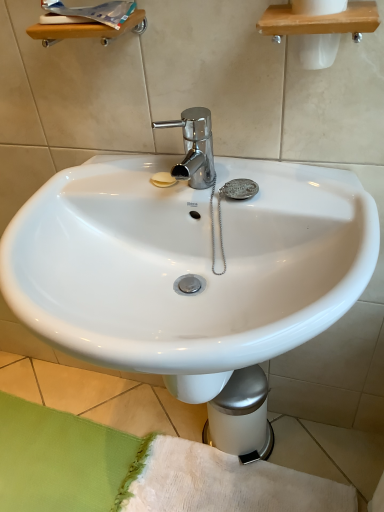
Question: Considering the relative sizes of green fabric bath mat at lower left and white glossy sink at center in the image provided, is green fabric bath mat at lower left shorter than white glossy sink at center?

Choices:
 (A) no
 (B) yes

Answer: (B)

Question: Is green fabric bath mat at lower left wider than white glossy sink at center?

Choices:
 (A) no
 (B) yes

Answer: (B)

Question: Is white glossy sink at center surrounded by green fabric bath mat at lower left?

Choices:
 (A) no
 (B) yes

Answer: (A)

Question: From a real-world perspective, is green fabric bath mat at lower left under white glossy sink at center?

Choices:
 (A) yes
 (B) no

Answer: (A)

Question: Considering the relative positions of green fabric bath mat at lower left and white glossy sink at center in the image provided, is green fabric bath mat at lower left to the right of white glossy sink at center from the viewer's perspective?

Choices:
 (A) yes
 (B) no

Answer: (B)

Question: Is green fabric bath mat at lower left smaller than white glossy sink at center?

Choices:
 (A) no
 (B) yes

Answer: (B)

Question: From a real-world perspective, is white glossy sink at center beneath green fabric bath mat at lower left?

Choices:
 (A) yes
 (B) no

Answer: (B)

Question: Is white glossy sink at center positioned with its back to green fabric bath mat at lower left?

Choices:
 (A) yes
 (B) no

Answer: (B)

Question: Is white glossy sink at center oriented towards green fabric bath mat at lower left?

Choices:
 (A) yes
 (B) no

Answer: (B)

Question: Considering the relative sizes of white glossy sink at center and green fabric bath mat at lower left in the image provided, is white glossy sink at center wider than green fabric bath mat at lower left?

Choices:
 (A) yes
 (B) no

Answer: (B)

Question: From the image's perspective, is white glossy sink at center below green fabric bath mat at lower left?

Choices:
 (A) yes
 (B) no

Answer: (B)

Question: Does white glossy sink at center lie in front of green fabric bath mat at lower left?

Choices:
 (A) no
 (B) yes

Answer: (B)

Question: Considering the positions of green fabric bath mat at lower left and white glossy sink at center in the image, is green fabric bath mat at lower left bigger or smaller than white glossy sink at center?

Choices:
 (A) small
 (B) big

Answer: (A)